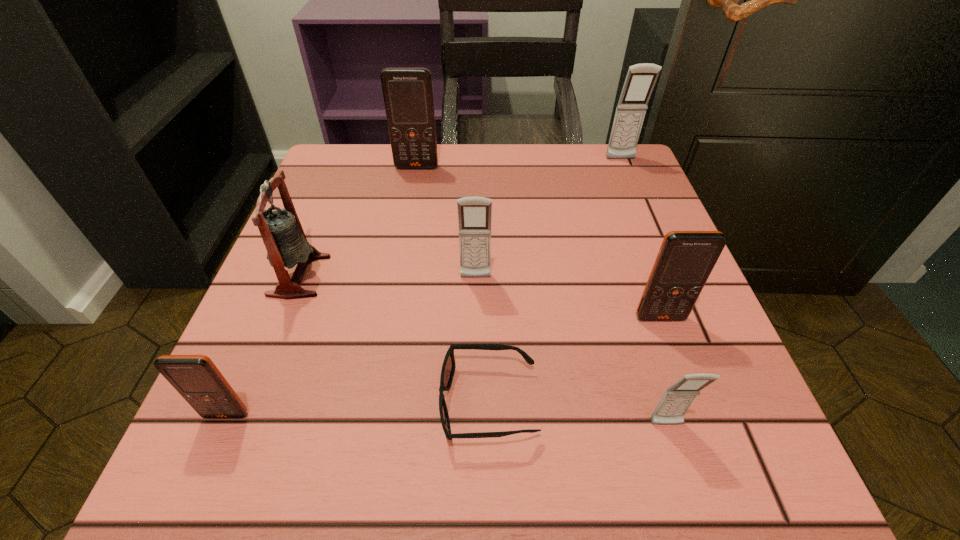
Locate an element on the screen. vacant space at the far edge of the desktop is located at coordinates (552, 150).

Find the location of `blank area at the near edge`. blank area at the near edge is located at coordinates (627, 444).

Where is `free space at the left edge of the desktop`? free space at the left edge of the desktop is located at coordinates (323, 206).

Image resolution: width=960 pixels, height=540 pixels. Identify the location of blank space at the right edge of the desktop. (672, 356).

Where is `vacant space at the near left corner`? The image size is (960, 540). vacant space at the near left corner is located at coordinates (237, 467).

Identify the location of vacant region at the far right corner of the desktop. (644, 177).

In the image, there is a desktop. Where is `vacant space at the near right corner`? vacant space at the near right corner is located at coordinates (743, 475).

Where is `free space between the shortest object and the leftmost cellular telephone`? free space between the shortest object and the leftmost cellular telephone is located at coordinates (357, 409).

Image resolution: width=960 pixels, height=540 pixels. I want to click on vacant area between the leftmost orange cellular telephone and the third farthest cellular telephone, so click(351, 346).

Where is `free spot between the sunglasses and the leftmost orange cellular telephone`? This screenshot has height=540, width=960. free spot between the sunglasses and the leftmost orange cellular telephone is located at coordinates (357, 409).